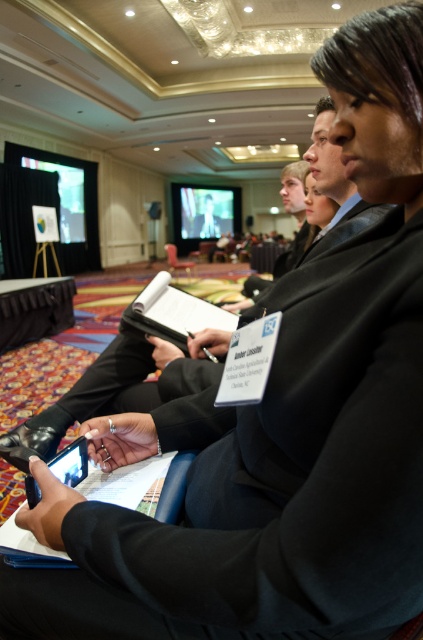
Which is above, black matte tablet computer at lower left or smooth skin man at center?

smooth skin man at center is above.

Between black matte tablet computer at lower left and smooth skin man at center, which one is positioned lower?

black matte tablet computer at lower left

At what (x,y) coordinates should I click in order to perform the action: click on black matte tablet computer at lower left. Please return your answer as a coordinate pair (x, y). Looking at the image, I should click on (71, 461).

This screenshot has height=640, width=423. I want to click on black matte tablet computer at lower left, so click(71, 461).

Does black matte tablet computer at lower left appear on the left side of wooden chair at center?

In fact, black matte tablet computer at lower left is to the right of wooden chair at center.

From the picture: Measure the distance between black matte tablet computer at lower left and wooden chair at center.

black matte tablet computer at lower left is 6.98 meters away from wooden chair at center.

Between point (35, 486) and point (169, 257), which one is positioned in front?

Positioned in front is point (35, 486).

Where is `black matte tablet computer at lower left`? This screenshot has height=640, width=423. black matte tablet computer at lower left is located at coordinates (71, 461).

Which is above, smooth skin man at center or wooden chair at center?

smooth skin man at center is above.

Does smooth skin man at center have a smaller size compared to wooden chair at center?

No, smooth skin man at center is not smaller than wooden chair at center.

Identify the location of smooth skin man at center. The height and width of the screenshot is (640, 423). tap(206, 218).